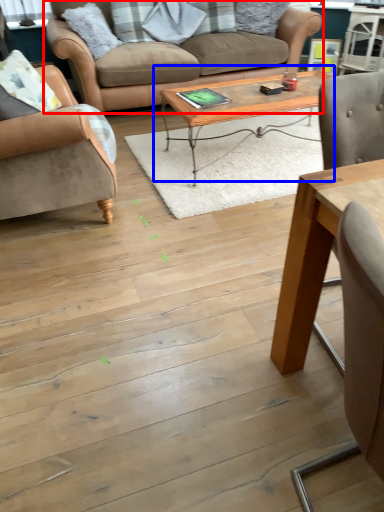
Question: Which object appears closest to the camera in this image, studio couch (highlighted by a red box) or coffee table (highlighted by a blue box)?

Choices:
 (A) studio couch
 (B) coffee table

Answer: (B)